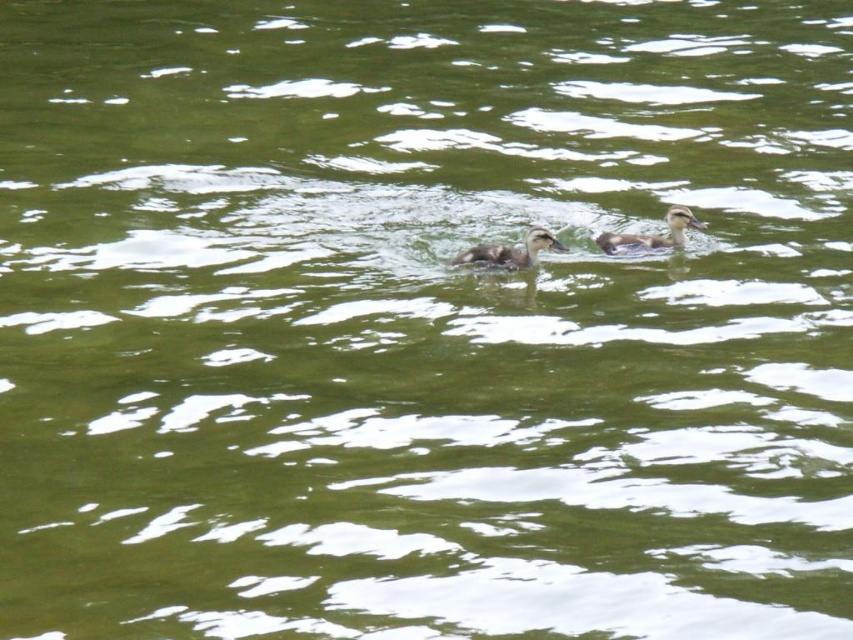
Which of these two, brown fuzzy duckling at center or brown speckled duckling at upper center, stands shorter?

brown fuzzy duckling at center

Is point (527, 252) more distant than point (679, 243)?

No, it is not.

Where is `brown fuzzy duckling at center`? This screenshot has width=853, height=640. brown fuzzy duckling at center is located at coordinates (509, 252).